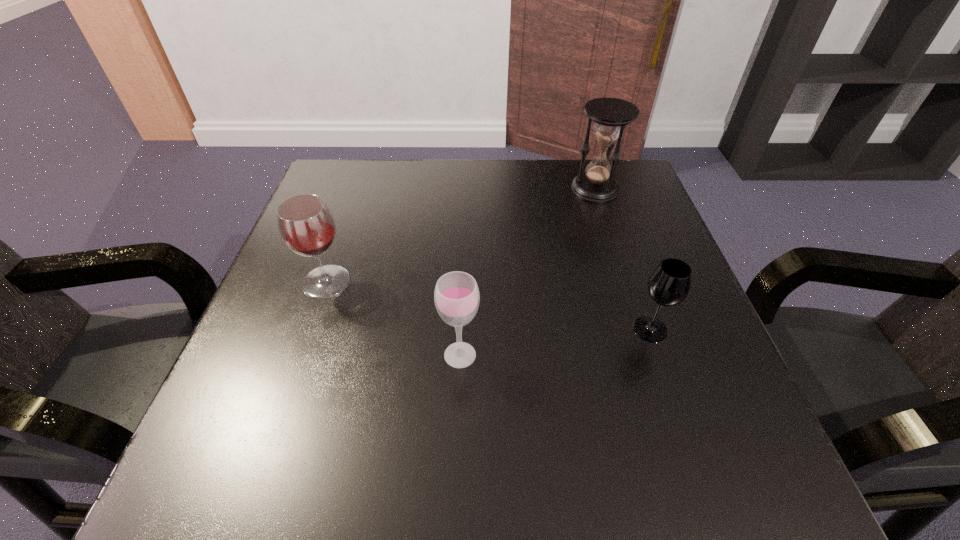
Where is `object that stands as the closest to the third object from right to left`? Image resolution: width=960 pixels, height=540 pixels. object that stands as the closest to the third object from right to left is located at coordinates (306, 225).

Locate which wineglass ranks second in proximity to the farthest object. Please provide its 2D coordinates. Your answer should be formatted as a tuple, i.e. [(x, y)], where the tuple contains the x and y coordinates of a point satisfying the conditions above.

[(456, 296)]

Locate which wineglass is the closest to the rightmost wineglass. Please provide its 2D coordinates. Your answer should be formatted as a tuple, i.e. [(x, y)], where the tuple contains the x and y coordinates of a point satisfying the conditions above.

[(456, 296)]

Image resolution: width=960 pixels, height=540 pixels. What are the coordinates of `free space in the image that satisfies the following two spatial constraints: 1. on the front side of the leftmost object; 2. on the left side of the rightmost wineglass` in the screenshot? It's located at (310, 329).

Where is `free location that satisfies the following two spatial constraints: 1. on the back side of the farthest wineglass; 2. on the left side of the farthest object`? free location that satisfies the following two spatial constraints: 1. on the back side of the farthest wineglass; 2. on the left side of the farthest object is located at coordinates (359, 188).

Where is `vacant space that satisfies the following two spatial constraints: 1. on the front side of the rightmost wineglass; 2. on the left side of the hourglass`? The height and width of the screenshot is (540, 960). vacant space that satisfies the following two spatial constraints: 1. on the front side of the rightmost wineglass; 2. on the left side of the hourglass is located at coordinates (641, 329).

At what (x,y) coordinates should I click in order to perform the action: click on free space in the image that satisfies the following two spatial constraints: 1. on the front side of the hourglass; 2. on the right side of the rightmost wineglass. Please return your answer as a coordinate pair (x, y). This screenshot has width=960, height=540. Looking at the image, I should click on (641, 329).

You are a GUI agent. You are given a task and a screenshot of the screen. Output one action in this format:
    pyautogui.click(x=<x>, y=<y>)
    Task: Click on the free location that satisfies the following two spatial constraints: 1. on the back side of the leftmost object; 2. on the right side of the hourglass
    This screenshot has width=960, height=540.
    Given the screenshot: What is the action you would take?
    pyautogui.click(x=359, y=188)